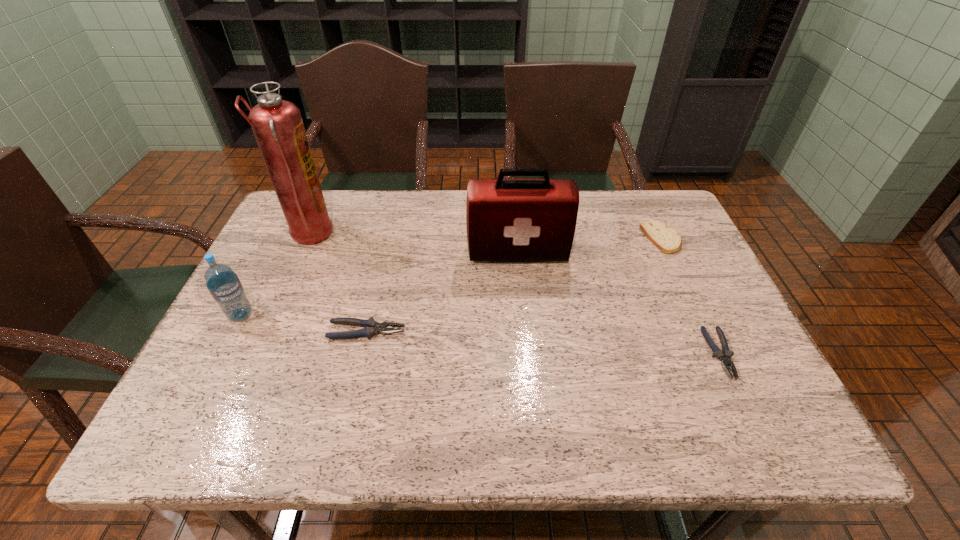
If equal spacing is the goal by inserting an additional pliers among them, please point out a vacant space for this new pliers. Please provide its 2D coordinates. Your answer should be formatted as a tuple, i.e. [(x, y)], where the tuple contains the x and y coordinates of a point satisfying the conditions above.

[(540, 342)]